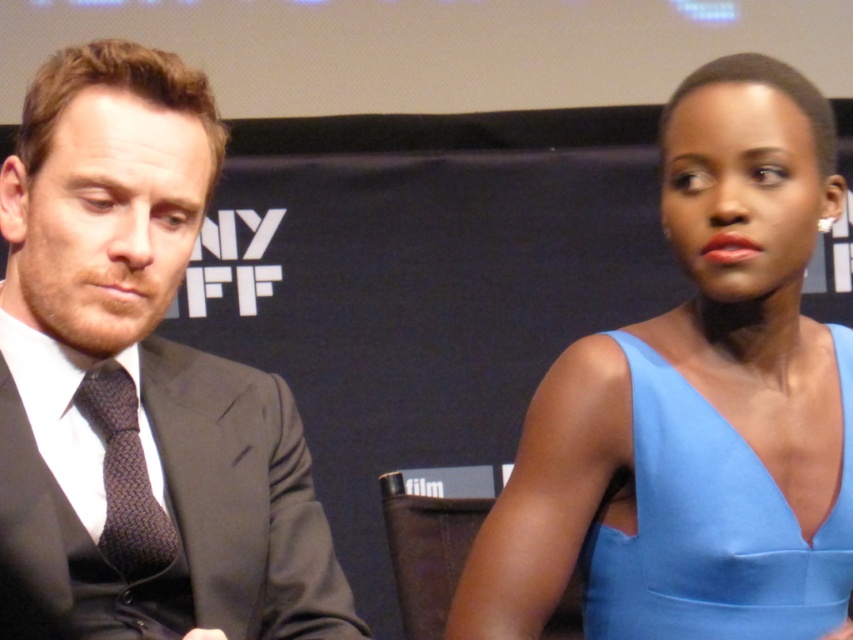
You are attending the NYFF event and need to find the matte black suit at left. Based on its coordinates, is it positioned closer to the top or bottom of the image?

The matte black suit at left is located at point 0.603 in the x and 0.163 in the y. Since the y coordinate is closer to 0, which is the top of the image, it is positioned closer to the bottom. Wait, that doesn t make sense. Let me think again. In coordinate systems, typically the origin is at the bottom left or top left. Hmm, the problem says the coordinates are given as x,y. But without knowing the coordinate system, maybe we can assume that lower y is bottom. Wait, the description says the man is seated,

You are a photographer at the NYFF event. You need to capture a closeup shot of both the light blue satin dress at right and the dark brown textured tie at left. Given that your camera has a minimum focus distance of 20 inches, will you be able to focus on both subjects simultaneously?

The light blue satin dress at right and dark brown textured tie at left are 21.11 inches apart, which is beyond the camera minimum focus distance of 20 inches. Therefore, you can focus on both subjects simultaneously.

You are a photographer at the NYFF event and need to ensure that your camera can capture both the matte black suit at left and the dark brown textured tie at left clearly. Considering their sizes, which object should you focus on first to ensure it is in sharp focus?

The matte black suit at left is bigger than the dark brown textured tie at left, so you should focus on the matte black suit at left first to ensure it is in sharp focus since it is larger and might require more precise focusing.